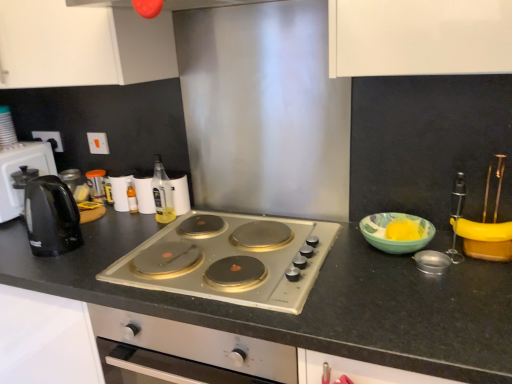
Where is `black granite countertop at center`? Image resolution: width=512 pixels, height=384 pixels. black granite countertop at center is located at coordinates (309, 301).

Describe the element at coordinates (162, 193) in the screenshot. I see `translucent glass bottle at center, the second bottle when ordered from left to right` at that location.

Where is `translucent glass bottle at center, arranged as the 1th bottle when viewed from the back`? translucent glass bottle at center, arranged as the 1th bottle when viewed from the back is located at coordinates (132, 197).

What is the approximate width of translucent glass bottle at center, the second bottle positioned from the right?

translucent glass bottle at center, the second bottle positioned from the right, is 1.36 inches wide.

What do you see at coordinates (230, 259) in the screenshot? The image size is (512, 384). I see `silver metallic stove at center` at bounding box center [230, 259].

The width and height of the screenshot is (512, 384). I want to click on black granite countertop at center, so click(x=309, y=301).

From their relative heights in the image, would you say white matte cabinet at upper left is taller or shorter than translucent glass bottle at center, arranged as the 1th bottle when viewed from the back?

white matte cabinet at upper left is taller than translucent glass bottle at center, arranged as the 1th bottle when viewed from the back.

Is white matte cabinet at upper left located outside translucent glass bottle at center, which ranks as the 2th bottle in front-to-back order?

Yes.

From a real-world perspective, which is physically below, white matte cabinet at upper left or translucent glass bottle at center, the 1th bottle positioned from the left?

In real-world perspective, translucent glass bottle at center, the 1th bottle positioned from the left, is lower.

Measure the distance from black plastic kettle at left to matte green bowl at right.

black plastic kettle at left and matte green bowl at right are 1.32 meters apart.

Is black plastic kettle at left outside of matte green bowl at right?

Indeed, black plastic kettle at left is completely outside matte green bowl at right.

From a real-world perspective, is black plastic kettle at left above or below matte green bowl at right?

In terms of real-world spatial position, black plastic kettle at left is above matte green bowl at right.

Which point is more distant from viewer, (17, 190) or (372, 234)?

Positioned behind is point (17, 190).

Does point (412, 333) appear closer or farther from the camera than point (133, 198)?

Clearly, point (412, 333) is closer to the camera than point (133, 198).

Would you say black granite countertop at center is a long distance from translucent glass bottle at center, which ranks as the 2th bottle in front-to-back order?

No, black granite countertop at center is not far from translucent glass bottle at center, which ranks as the 2th bottle in front-to-back order.

From the image's perspective, between black granite countertop at center and translucent glass bottle at center, the 1th bottle positioned from the left, who is located below?

black granite countertop at center, from the image's perspective.

Which object is more forward, black granite countertop at center or translucent glass bottle at center, arranged as the 1th bottle when viewed from the back?

Positioned in front is black granite countertop at center.

Considering the positions of objects translucent glass bottle at center, arranged as the second bottle when viewed from the back, and black granite countertop at center in the image provided, who is in front, translucent glass bottle at center, arranged as the second bottle when viewed from the back, or black granite countertop at center?

black granite countertop at center.

Does point (160, 157) lie behind point (477, 286)?

Yes, point (160, 157) is farther from viewer.

Does translucent glass bottle at center, the second bottle when ordered from left to right, have a greater height compared to black granite countertop at center?

In fact, translucent glass bottle at center, the second bottle when ordered from left to right, may be shorter than black granite countertop at center.

Can you confirm if translucent glass bottle at center, arranged as the second bottle when viewed from the back, is positioned to the left of black granite countertop at center?

Incorrect, translucent glass bottle at center, arranged as the second bottle when viewed from the back, is not on the left side of black granite countertop at center.

From the image's perspective, which object appears higher, black granite countertop at center or white matte cabinet at upper left?

white matte cabinet at upper left.

Is white matte cabinet at upper left inside black granite countertop at center?

Actually, white matte cabinet at upper left is outside black granite countertop at center.

Does black granite countertop at center have a lesser height compared to white matte cabinet at upper left?

Incorrect, the height of black granite countertop at center does not fall short of that of white matte cabinet at upper left.

Which object is more forward, white matte cabinet at upper left or silver metallic stove at center?

silver metallic stove at center is in front.

Where is `cabinetry to the left of silver metallic stove at center`? The height and width of the screenshot is (384, 512). cabinetry to the left of silver metallic stove at center is located at coordinates (82, 45).

Considering the relative sizes of white matte cabinet at upper left and silver metallic stove at center in the image provided, is white matte cabinet at upper left smaller than silver metallic stove at center?

Incorrect, white matte cabinet at upper left is not smaller in size than silver metallic stove at center.

From the image's perspective, between white matte cabinet at upper left and silver metallic stove at center, which one is located above?

white matte cabinet at upper left.

Which is behind, black plastic kettle at left or silver metallic stove at center?

black plastic kettle at left is further from the camera.

Is black plastic kettle at left inside the boundaries of silver metallic stove at center, or outside?

black plastic kettle at left is outside silver metallic stove at center.

From the image's perspective, is black plastic kettle at left positioned above or below silver metallic stove at center?

Clearly, from the image's perspective, black plastic kettle at left is above silver metallic stove at center.

From a real-world perspective, is black plastic kettle at left located beneath silver metallic stove at center?

Actually, black plastic kettle at left is physically above silver metallic stove at center in the real world.

From a real-world perspective, count 2nd bottles downward from the white matte cabinet at upper left and point to it. Please provide its 2D coordinates.

[(132, 197)]

The width and height of the screenshot is (512, 384). Identify the location of kitchen appliance located on the left of matte green bowl at right. (19, 171).

When comparing their distances from matte green bowl at right, does translucent glass bottle at center, which is the 1th bottle from front to back, or black granite countertop at center seem further?

Based on the image, translucent glass bottle at center, which is the 1th bottle from front to back, appears to be further to matte green bowl at right.

From the picture: From the image, which object appears to be nearer to silver metallic stove at center, matte green bowl at right or translucent glass bottle at center, the second bottle when ordered from left to right?

The object closer to silver metallic stove at center is matte green bowl at right.

Based on their spatial positions, is black granite countertop at center or translucent glass bottle at center, arranged as the 1th bottle when viewed from the back, closer to black plastic kettle at left?

translucent glass bottle at center, arranged as the 1th bottle when viewed from the back, is positioned closer to the anchor black plastic kettle at left.

From the image, which object appears to be nearer to matte green bowl at right, silver metallic stove at center or translucent glass bottle at center, the first bottle viewed from the right?

silver metallic stove at center is closer to matte green bowl at right.

Estimate the real-world distances between objects in this image. Which object is further from black plastic kettle at left, white matte cabinet at upper left or black granite countertop at center?

black granite countertop at center is further to black plastic kettle at left.

Looking at the image, which one is located further to translucent glass bottle at center, the first bottle viewed from the right, white matte cabinet at upper left or black plastic kettle at left?

Among the two, black plastic kettle at left is located further to translucent glass bottle at center, the first bottle viewed from the right.

Looking at the image, which one is located closer to silver metallic stove at center, black granite countertop at center or translucent glass bottle at center, the first bottle viewed from the right?

black granite countertop at center.

Based on their spatial positions, is translucent glass bottle at center, the second bottle positioned from the right, or silver metallic stove at center closer to black granite countertop at center?

silver metallic stove at center is closer to black granite countertop at center.

Where is `bottle between black plastic kettle at left and translucent glass bottle at center, arranged as the second bottle when viewed from the back, from left to right`? The image size is (512, 384). bottle between black plastic kettle at left and translucent glass bottle at center, arranged as the second bottle when viewed from the back, from left to right is located at coordinates (132, 197).

Find the location of `gas stove between white matte cabinet at upper left and black granite countertop at center in the up-down direction`. gas stove between white matte cabinet at upper left and black granite countertop at center in the up-down direction is located at coordinates (230, 259).

Find the location of a particular element. The image size is (512, 384). gas stove situated between translucent glass bottle at center, the second bottle positioned from the right, and matte green bowl at right from left to right is located at coordinates (230, 259).

You are a GUI agent. You are given a task and a screenshot of the screen. Output one action in this format:
    pyautogui.click(x=<x>, y=<y>)
    Task: Click on the kitchen appliance between white matte cabinet at upper left and translucent glass bottle at center, the 1th bottle positioned from the left, in the vertical direction
    
    Given the screenshot: What is the action you would take?
    pyautogui.click(x=19, y=171)